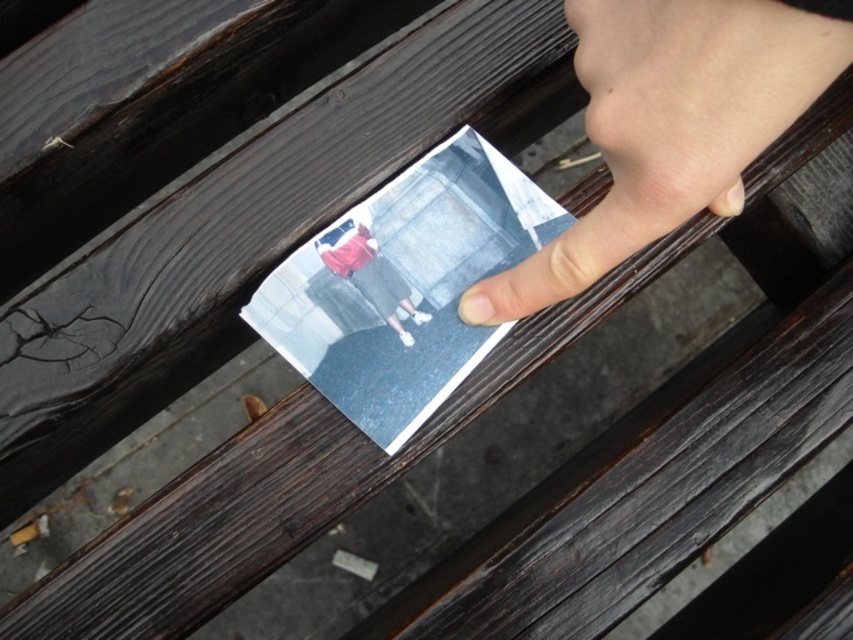
Is point (476, 266) closer to viewer compared to point (357, 273)?

That is False.

Does matte paper postcard at center appear over matte red shirt at center?

Actually, matte paper postcard at center is below matte red shirt at center.

Who is more distant from viewer, (465, 358) or (350, 256)?

The point (350, 256) is behind.

Find the location of a particular element. matte paper postcard at center is located at coordinates click(404, 285).

Can you confirm if pale skin at upper right is positioned above matte paper postcard at center?

Yes, pale skin at upper right is above matte paper postcard at center.

Which is in front, point (677, 61) or point (488, 186)?

Point (677, 61)

This screenshot has height=640, width=853. Identify the location of pale skin at upper right. (670, 125).

Can you confirm if pale skin at upper right is wider than matte red shirt at center?

Yes, pale skin at upper right is wider than matte red shirt at center.

Between point (585, 42) and point (322, 244), which one is positioned in front?

Point (585, 42) is more forward.

I want to click on pale skin at upper right, so click(x=670, y=125).